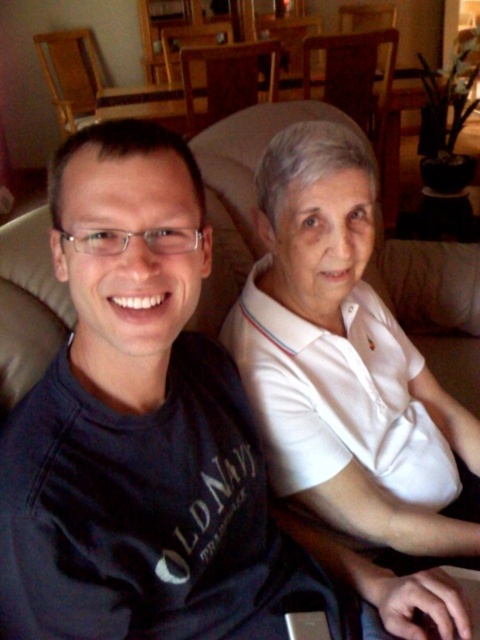
You are a photographer setting up a shoot in this room. You need to ensure that the white smooth shirt at center and the wooden chair at upper center are both visible in the frame. Given that the camera can only focus on one subject at a time, which object should you prioritize focusing on to ensure it appears clear in the photo?

The white smooth shirt at center is smaller than the wooden chair at upper center, so you should prioritize focusing on the wooden chair at upper center to ensure it appears clear in the photo.

You are a photographer setting up for a family portrait. You notice the white smooth shirt at center and the wooden chair at upper center. Which object is closer to the camera?

The white smooth shirt at center is closer to the camera because it is in front of the wooden chair at upper center.